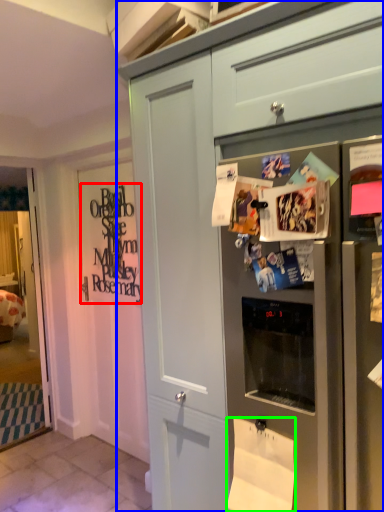
Question: Considering the real-world distances, which object is closest to signature (highlighted by a red box)? cabinetry (highlighted by a blue box) or toilet paper (highlighted by a green box).

Choices:
 (A) cabinetry
 (B) toilet paper

Answer: (A)